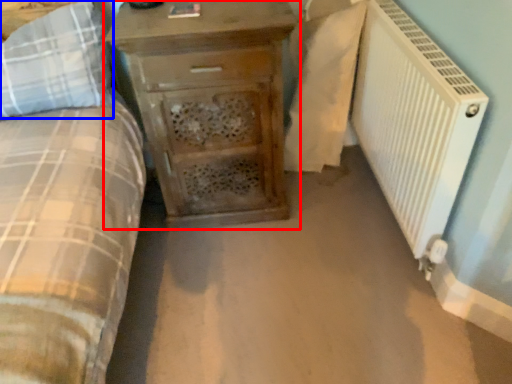
Question: Which of the following is the farthest to the observer, chest of drawers (highlighted by a red box) or pillow (highlighted by a blue box)?

Choices:
 (A) chest of drawers
 (B) pillow

Answer: (A)